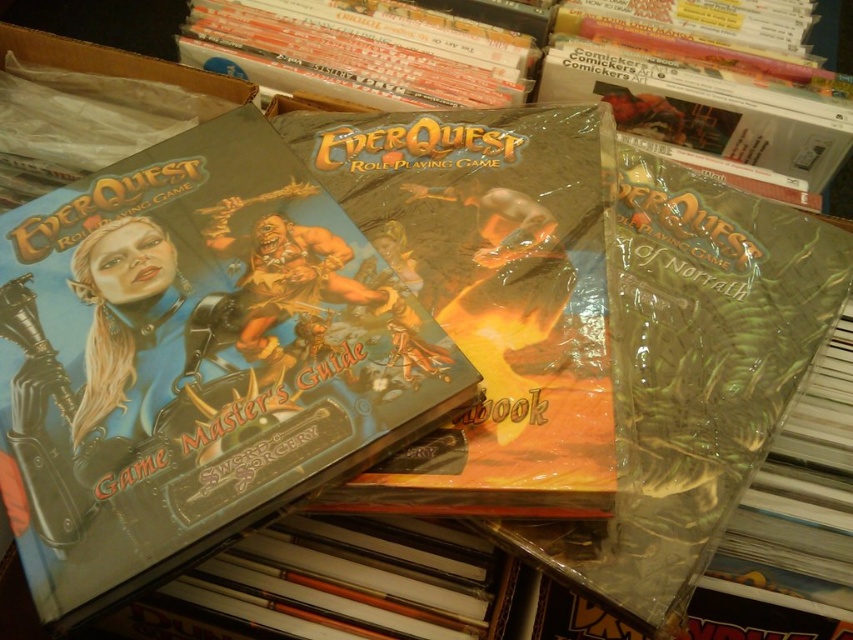
Question: Which object is the closest to the shiny plastic everquest rpg book at center?

Choices:
 (A) hardcover book at upper center
 (B) matte plastic everquest game master's guide at left

Answer: (B)

Question: Does matte plastic everquest game master's guide at left appear on the left side of hardcover book at upper center?

Choices:
 (A) no
 (B) yes

Answer: (B)

Question: Which of these objects is positioned closest to the matte plastic everquest game master's guide at left?

Choices:
 (A) shiny plastic everquest rpg book at center
 (B) hardcover book at upper center

Answer: (A)

Question: Considering the real-world distances, which object is farthest from the shiny plastic everquest rpg book at center?

Choices:
 (A) matte plastic everquest game master's guide at left
 (B) hardcover book at upper center

Answer: (B)

Question: In this image, where is matte plastic everquest game master's guide at left located relative to hardcover book at upper center?

Choices:
 (A) left
 (B) right

Answer: (A)

Question: Does matte plastic everquest game master's guide at left come behind hardcover book at upper center?

Choices:
 (A) yes
 (B) no

Answer: (B)